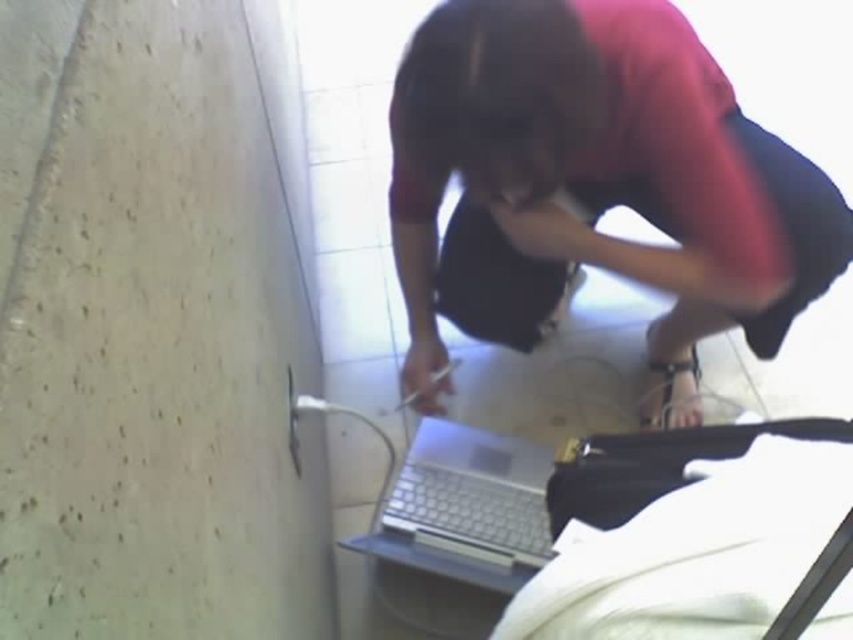
You are a technician trying to fix a laptop. You have two laptops in front of you, a matte black laptop at lower center and a silver metallic laptop at lower center. Which one is on the right side?

The matte black laptop at lower center is positioned on the right side of silver metallic laptop at lower center, so the matte black laptop at lower center is on the right.

You are setting up a desk area and have both a matte black laptop at lower center and a silver metallic laptop at lower center. If you want to place them side by side on a shelf that can only accommodate the wider one, which laptop should you choose?

The matte black laptop at lower center might be wider than the silver metallic laptop at lower center, so you should choose the matte black laptop at lower center to place on the shelf.